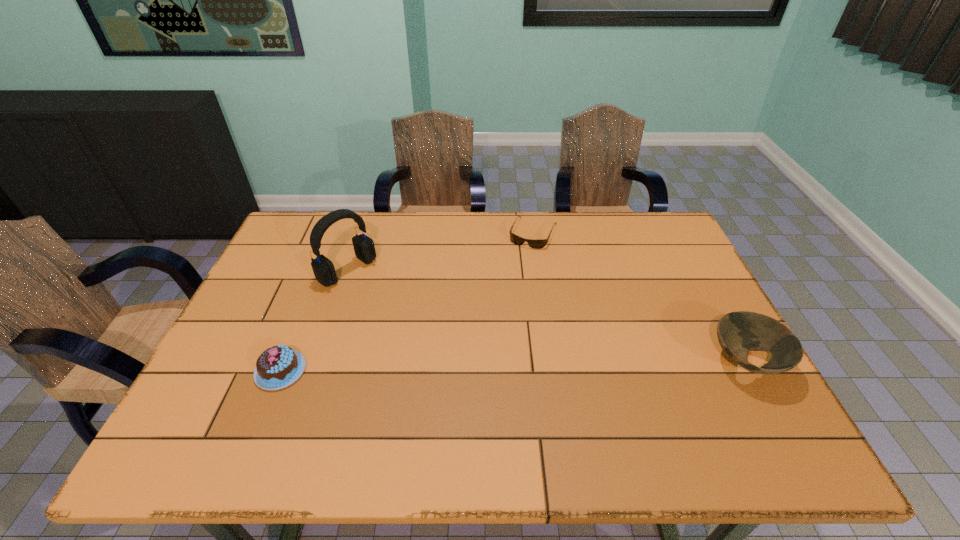
Where is `object that is positioned at the right edge`? The height and width of the screenshot is (540, 960). object that is positioned at the right edge is located at coordinates (739, 332).

What are the coordinates of `object situated at the near left corner` in the screenshot? It's located at (277, 367).

Locate an element on the screen. object located in the near right corner section of the desktop is located at coordinates (739, 332).

In order to click on free space at the far edge of the desktop in this screenshot , I will do `click(566, 237)`.

Find the location of `free space at the near edge of the desktop`. free space at the near edge of the desktop is located at coordinates (541, 401).

The height and width of the screenshot is (540, 960). What are the coordinates of `vacant space at the left edge` in the screenshot? It's located at (262, 327).

The height and width of the screenshot is (540, 960). I want to click on free location at the right edge, so click(x=658, y=269).

At what (x,y) coordinates should I click in order to perform the action: click on free region at the far left corner. Please return your answer as a coordinate pair (x, y). The width and height of the screenshot is (960, 540). Looking at the image, I should click on click(315, 217).

I want to click on vacant space at the far right corner of the desktop, so click(634, 240).

Locate an element on the screen. This screenshot has width=960, height=540. vacant area that lies between the sunglasses and the third nearest object is located at coordinates (441, 251).